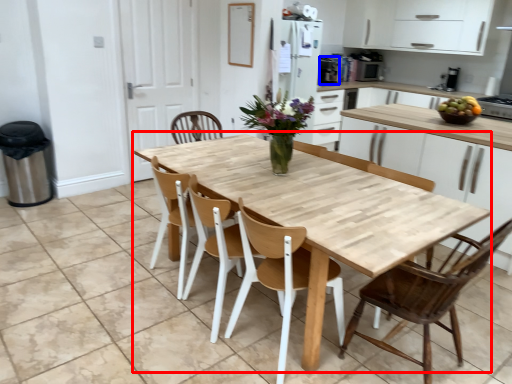
Question: Which object is further to the camera taking this photo, kitchen & dining room table (highlighted by a red box) or appliance (highlighted by a blue box)?

Choices:
 (A) kitchen & dining room table
 (B) appliance

Answer: (B)